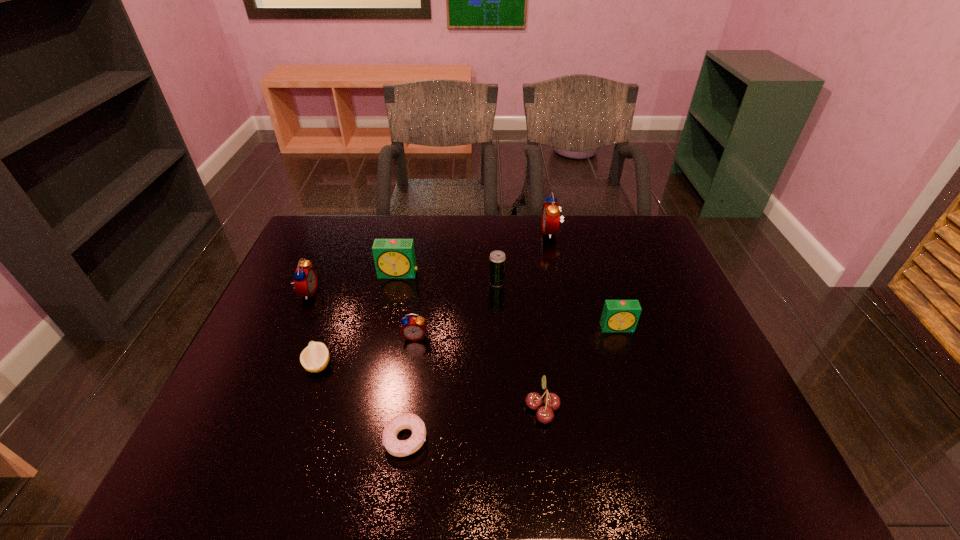
This screenshot has width=960, height=540. What are the coordinates of `object located in the near edge section of the desktop` in the screenshot? It's located at (399, 448).

This screenshot has height=540, width=960. In order to click on object that is at the left edge in this screenshot , I will do `click(305, 282)`.

This screenshot has height=540, width=960. In order to click on free space at the far edge in this screenshot , I will do `click(423, 225)`.

At what (x,y) coordinates should I click in order to perform the action: click on free spot at the near edge of the desktop. Please return your answer as a coordinate pair (x, y). The width and height of the screenshot is (960, 540). Looking at the image, I should click on (x=446, y=448).

Locate an element on the screen. The image size is (960, 540). blank space at the left edge is located at coordinates (281, 400).

In order to click on vacant space at the right edge of the desktop in this screenshot , I will do `click(710, 372)`.

This screenshot has width=960, height=540. Find the location of `vacant area at the far left corner`. vacant area at the far left corner is located at coordinates (330, 256).

In the image, there is a desktop. Where is `vacant area at the far right corner`? The height and width of the screenshot is (540, 960). vacant area at the far right corner is located at coordinates (619, 242).

Locate an element on the screen. The image size is (960, 540). unoccupied position between the white doughnut and the sixth object from left to right is located at coordinates (451, 361).

I want to click on vacant area between the farther green alarm clock and the leftmost red alarm clock, so click(x=353, y=283).